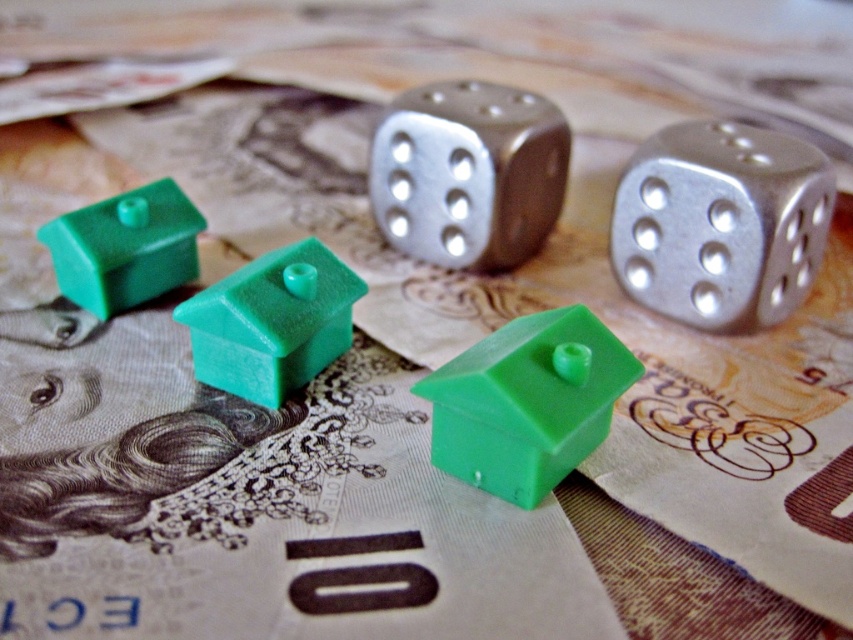
This screenshot has height=640, width=853. What do you see at coordinates (720, 224) in the screenshot?
I see `silver metallic dice at upper center` at bounding box center [720, 224].

Can you confirm if silver metallic dice at upper center is taller than green plastic house at center?

Correct, silver metallic dice at upper center is much taller as green plastic house at center.

Locate an element on the screen. The height and width of the screenshot is (640, 853). silver metallic dice at upper center is located at coordinates [x=720, y=224].

The height and width of the screenshot is (640, 853). In order to click on silver metallic dice at upper center in this screenshot , I will do `click(720, 224)`.

Find the location of a particular element. This screenshot has width=853, height=640. metallic silver dice at center is located at coordinates (468, 173).

Is metallic silver dice at center wider than green matte house at center?

Yes.

Is point (390, 154) farther from viewer compared to point (323, 340)?

Yes, it is behind point (323, 340).

I want to click on metallic silver dice at center, so click(468, 173).

Does silver metallic dice at upper center appear under green matte house at center?

No.

Is silver metallic dice at upper center positioned at the back of green matte house at center?

Yes, silver metallic dice at upper center is behind green matte house at center.

Who is more forward, (697, 320) or (323, 250)?

Positioned in front is point (323, 250).

The image size is (853, 640). I want to click on silver metallic dice at upper center, so click(720, 224).